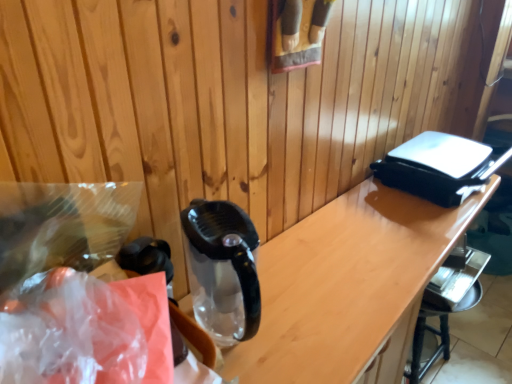
This screenshot has width=512, height=384. I want to click on vacant space underneath translucent plastic bag at left (from a real-world perspective), so click(x=91, y=343).